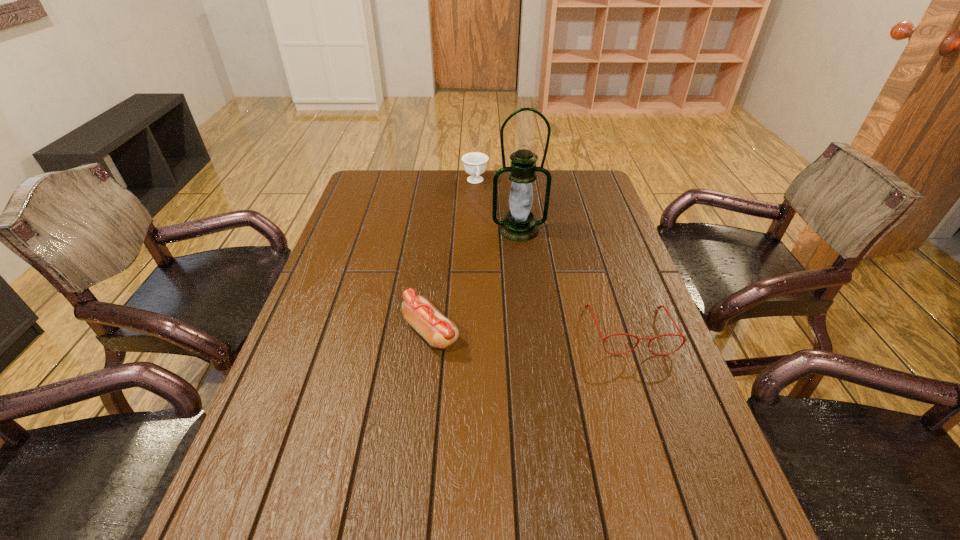
The width and height of the screenshot is (960, 540). What are the coordinates of `vacant region located 0.070m on the side of the teacup with the handle` in the screenshot? It's located at (481, 200).

At what (x,y) coordinates should I click in order to perform the action: click on vacant space located on the side of the teacup with the handle. Please return your answer as a coordinate pair (x, y). The height and width of the screenshot is (540, 960). Looking at the image, I should click on (492, 233).

This screenshot has height=540, width=960. I want to click on vacant space positioned on the side of the teacup with the handle, so click(x=487, y=218).

At what (x,y) coordinates should I click in order to perform the action: click on object that is at the far edge. Please return your answer as a coordinate pair (x, y). Looking at the image, I should click on point(474,162).

Locate an element on the screen. object located at the right edge is located at coordinates 658,307.

This screenshot has height=540, width=960. Find the location of `free space at the far edge`. free space at the far edge is located at coordinates (455, 185).

In the image, there is a desktop. Where is `vacant space at the near edge`? The image size is (960, 540). vacant space at the near edge is located at coordinates (397, 500).

Where is `free space at the left edge of the desktop`? free space at the left edge of the desktop is located at coordinates 354,234.

Where is `vacant space at the right edge of the desktop`? The height and width of the screenshot is (540, 960). vacant space at the right edge of the desktop is located at coordinates (636, 312).

Identify the location of free space at the far right corner. The height and width of the screenshot is (540, 960). (602, 190).